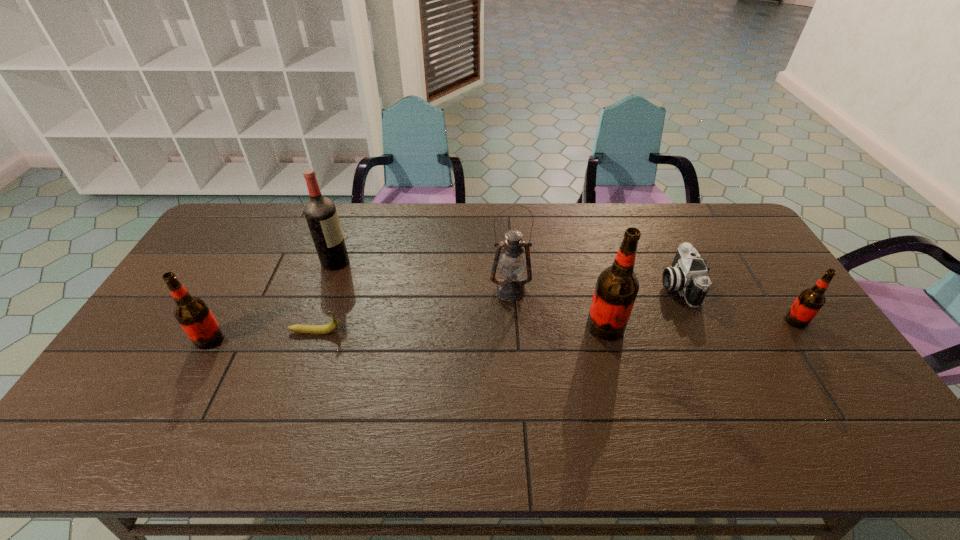
The image size is (960, 540). Find the location of `oil lamp`. oil lamp is located at coordinates (510, 287).

Locate an element on the screen. free region located 0.070m on the front of the leftmost root beer is located at coordinates (x=192, y=372).

Where is `vacant region located 0.290m on the left of the third object from right to left`? This screenshot has width=960, height=540. vacant region located 0.290m on the left of the third object from right to left is located at coordinates (487, 327).

Where is `free location located on the left of the rightmost root beer`? The height and width of the screenshot is (540, 960). free location located on the left of the rightmost root beer is located at coordinates (652, 321).

You are a GUI agent. You are given a task and a screenshot of the screen. Output one action in this format:
    pyautogui.click(x=<x>, y=<y>)
    Task: Click on the vacant space situated on the front-facing side of the liquor
    
    Given the screenshot: What is the action you would take?
    pyautogui.click(x=376, y=262)

Identify the location of blank space located 0.110m at the stem of the shortest object. This screenshot has width=960, height=540. (379, 332).

Locate an element on the screen. vacant area situated on the back of the camera is located at coordinates click(642, 206).

Image resolution: width=960 pixels, height=540 pixels. I want to click on vacant area located on the left of the oil lamp, so click(394, 291).

The height and width of the screenshot is (540, 960). I want to click on object that is at the left edge, so click(192, 313).

At what (x,y) coordinates should I click in order to perform the action: click on object that is at the right edge. Please return your answer as a coordinate pair (x, y). Looking at the image, I should click on (809, 302).